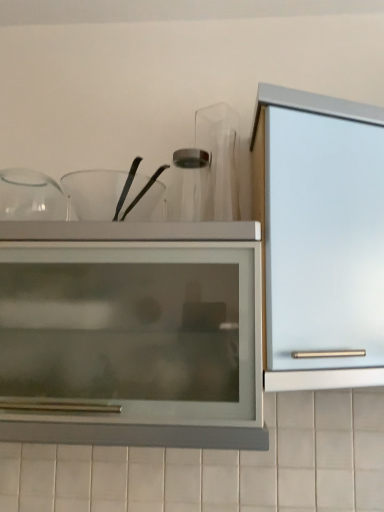
Question: Is satin silver cabinet at right facing towards matte glass cupboard at center?

Choices:
 (A) no
 (B) yes

Answer: (A)

Question: Can you confirm if satin silver cabinet at right is shorter than matte glass cupboard at center?

Choices:
 (A) no
 (B) yes

Answer: (A)

Question: Is satin silver cabinet at right not within matte glass cupboard at center?

Choices:
 (A) yes
 (B) no

Answer: (A)

Question: Is satin silver cabinet at right at the left side of matte glass cupboard at center?

Choices:
 (A) no
 (B) yes

Answer: (A)

Question: Is satin silver cabinet at right oriented away from matte glass cupboard at center?

Choices:
 (A) yes
 (B) no

Answer: (B)

Question: From their relative heights in the image, would you say matte glass cupboard at center is taller or shorter than transparent glass bowls at upper center?

Choices:
 (A) short
 (B) tall

Answer: (B)

Question: Considering the positions of matte glass cupboard at center and transparent glass bowls at upper center in the image, is matte glass cupboard at center bigger or smaller than transparent glass bowls at upper center?

Choices:
 (A) big
 (B) small

Answer: (A)

Question: Considering their positions, is matte glass cupboard at center located in front of or behind transparent glass bowls at upper center?

Choices:
 (A) behind
 (B) front

Answer: (B)

Question: From the image's perspective, is matte glass cupboard at center above or below transparent glass bowls at upper center?

Choices:
 (A) above
 (B) below

Answer: (B)

Question: From the image's perspective, is satin silver cabinet at right located above or below matte glass cupboard at center?

Choices:
 (A) above
 (B) below

Answer: (A)

Question: In terms of height, does satin silver cabinet at right look taller or shorter compared to matte glass cupboard at center?

Choices:
 (A) tall
 (B) short

Answer: (A)

Question: Is satin silver cabinet at right inside the boundaries of matte glass cupboard at center, or outside?

Choices:
 (A) outside
 (B) inside

Answer: (A)

Question: In terms of width, does satin silver cabinet at right look wider or thinner when compared to matte glass cupboard at center?

Choices:
 (A) wide
 (B) thin

Answer: (B)

Question: From a real-world perspective, is matte glass cupboard at center physically located above or below satin silver cabinet at right?

Choices:
 (A) above
 (B) below

Answer: (B)

Question: Choose the correct answer: Is matte glass cupboard at center inside satin silver cabinet at right or outside it?

Choices:
 (A) inside
 (B) outside

Answer: (B)